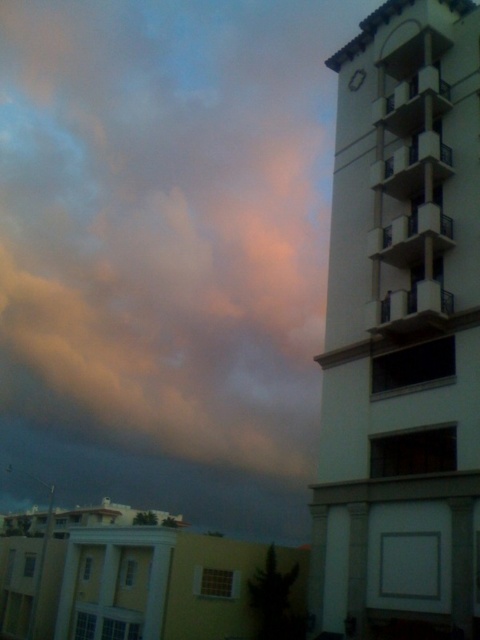
Does white concrete bell tower at right have a lesser height compared to metallic silver clock at upper right?

In fact, white concrete bell tower at right may be taller than metallic silver clock at upper right.

Can you confirm if white concrete bell tower at right is positioned to the left of metallic silver clock at upper right?

No, white concrete bell tower at right is not to the left of metallic silver clock at upper right.

This screenshot has width=480, height=640. Describe the element at coordinates (403, 333) in the screenshot. I see `white concrete bell tower at right` at that location.

Locate an element on the screen. The height and width of the screenshot is (640, 480). white concrete bell tower at right is located at coordinates (403, 333).